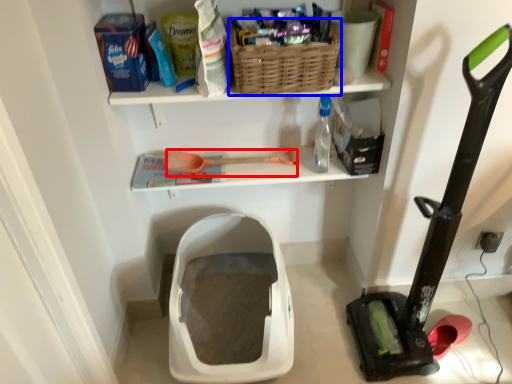
Question: Which point is further to the camera, tool (highlighted by a red box) or basket (highlighted by a blue box)?

Choices:
 (A) tool
 (B) basket

Answer: (A)